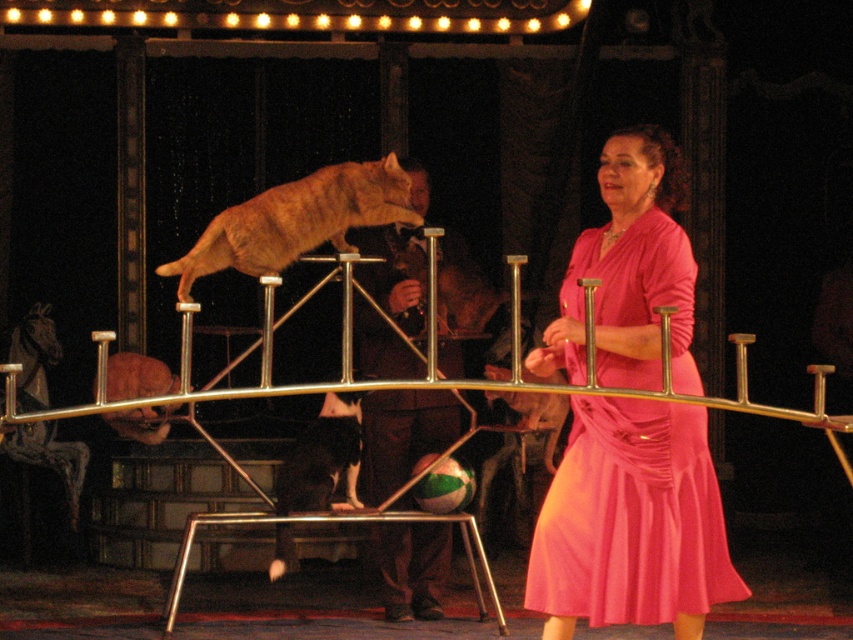
You are a photographer at the circus and want to capture a photo where the orange fur cat at center is positioned to the left of the pink satin dress at center. Based on the scene description, is this arrangement possible?

Yes, because the pink satin dress at center is already to the right of the orange fur cat at center, so the orange fur cat at center is naturally positioned to the left of the pink satin dress at center.

You are a stagehand in the circus and need to ensure the orange fur cat at center can comfortably pass through the space between the smooth leather glove at center and the metallic bars. Given that the cat requires at least 10 cm of clearance, can it fit through the space?

The smooth leather glove at center is bigger than the orange fur cat at center, so there is sufficient space for the cat to pass through with the required 10 cm clearance.

You are a stagehand preparing to adjust the lighting for the next act. You need to position a spotlight so it illuminates both the pink satin dress at center and the smooth leather glove at center without any overlap. Given their heights, which object should the spotlight be aimed higher to reach first?

The pink satin dress at center is taller than the smooth leather glove at center, so the spotlight should be aimed higher to reach the pink satin dress at center first.